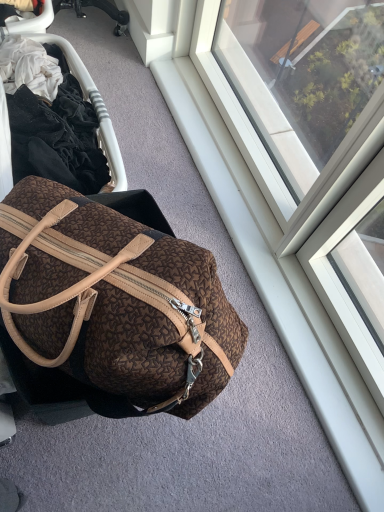
What is the approximate height of brown textured fabric bag at center?

brown textured fabric bag at center is 12.04 inches tall.

I want to click on brown textured fabric bag at center, so click(x=126, y=300).

What do you see at coordinates (126, 300) in the screenshot? I see `brown textured fabric bag at center` at bounding box center [126, 300].

You are a GUI agent. You are given a task and a screenshot of the screen. Output one action in this format:
    pyautogui.click(x=<x>, y=<y>)
    Task: Click on the brown textured fabric bag at center
    The width and height of the screenshot is (384, 512).
    Given the screenshot: What is the action you would take?
    pyautogui.click(x=126, y=300)